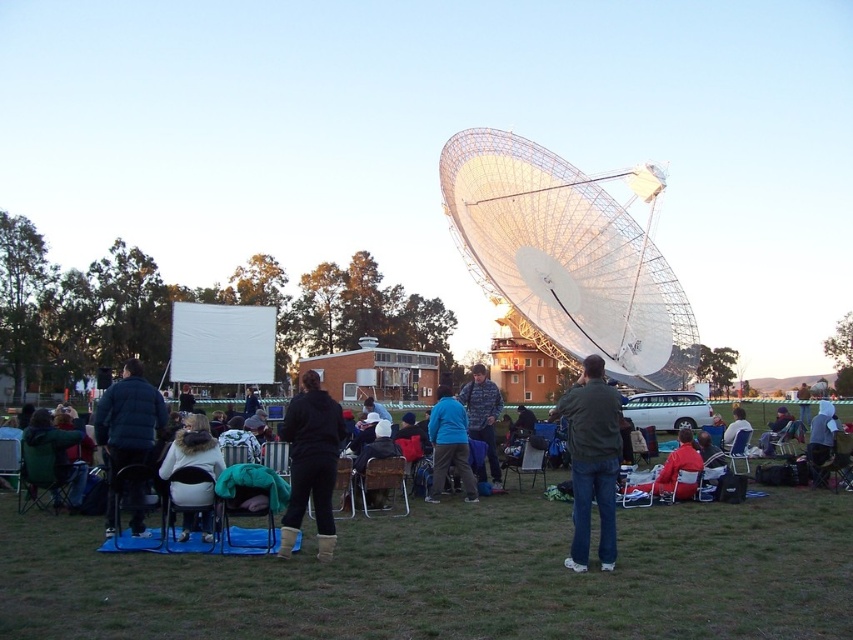
Question: Which of the following is the farthest from the observer?

Choices:
 (A) (454, 435)
 (B) (741, 420)

Answer: (B)

Question: Is green fabric jacket at lower left positioned behind dark blue jacket at lower right?

Choices:
 (A) yes
 (B) no

Answer: (B)

Question: From the image, what is the correct spatial relationship of green fabric jacket at center in relation to matte black jacket at center?

Choices:
 (A) below
 (B) above

Answer: (B)

Question: Which of the following is the closest to the observer?

Choices:
 (A) (177, 458)
 (B) (445, 452)
 (C) (656, 477)
 (D) (291, 440)

Answer: (A)

Question: Considering the relative positions of green fabric jacket at lower left and matte black jacket at center in the image provided, where is green fabric jacket at lower left located with respect to matte black jacket at center?

Choices:
 (A) left
 (B) right

Answer: (A)

Question: Which point is closer to the camera?

Choices:
 (A) black leather boots at center
 (B) matte black jacket at center
 (C) white fleece jacket at lower left
 (D) green fabric jacket at center

Answer: (D)